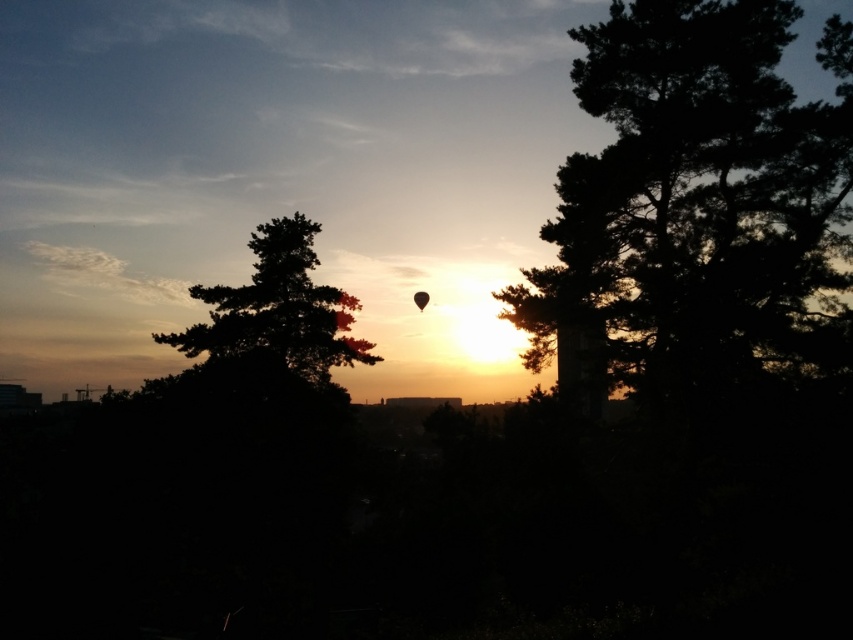
You are a photographer trying to capture the sunset. You notice the silhouette tree at left and the transparent black balloon at center. Which object is positioned lower in the scene?

The silhouette tree at left is located below the transparent black balloon at center, so it is positioned lower in the scene.

In the sunset scene with silhouetted trees, there is a point marked at coordinates (688,200). Which object from the list is located at this point? The objects are dark green textured tree at right.

The dark green textured tree at right is located at point (688,200).

You are standing in the sunset scene and want to walk from the point at coordinates point (340, 326) to the point at coordinates point (418, 291). Will you be moving towards the horizon or away from it?

Since point (340, 326) is in front of point (418, 291), moving from the former to the latter would mean moving away from the horizon.